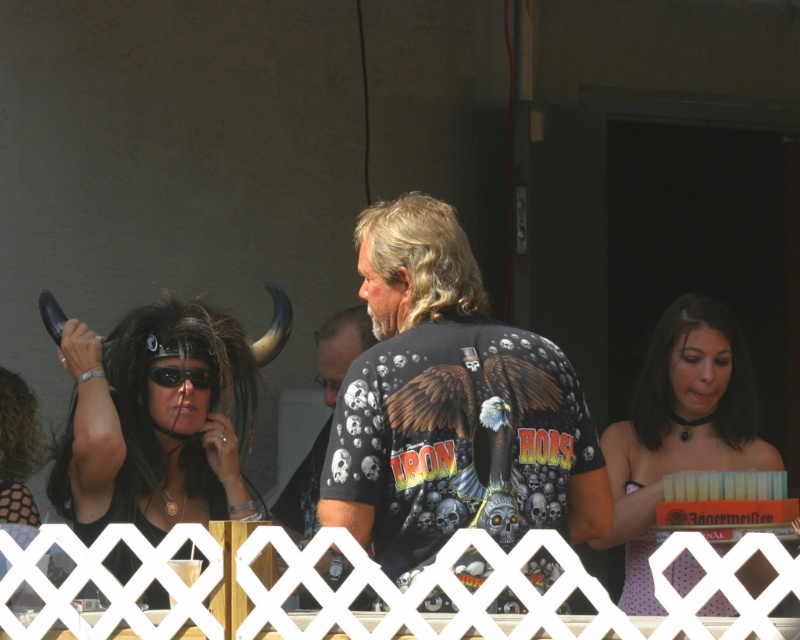
You are a photographer trying to capture a wide shot of the golden blonde hair at center and the polka dot fabric at lower left. Based on their sizes, which one should you focus on first to ensure both fit in the frame?

The golden blonde hair at center has a greater width than the polka dot fabric at lower left, so you should focus on the golden blonde hair at center first to ensure both fit in the frame.